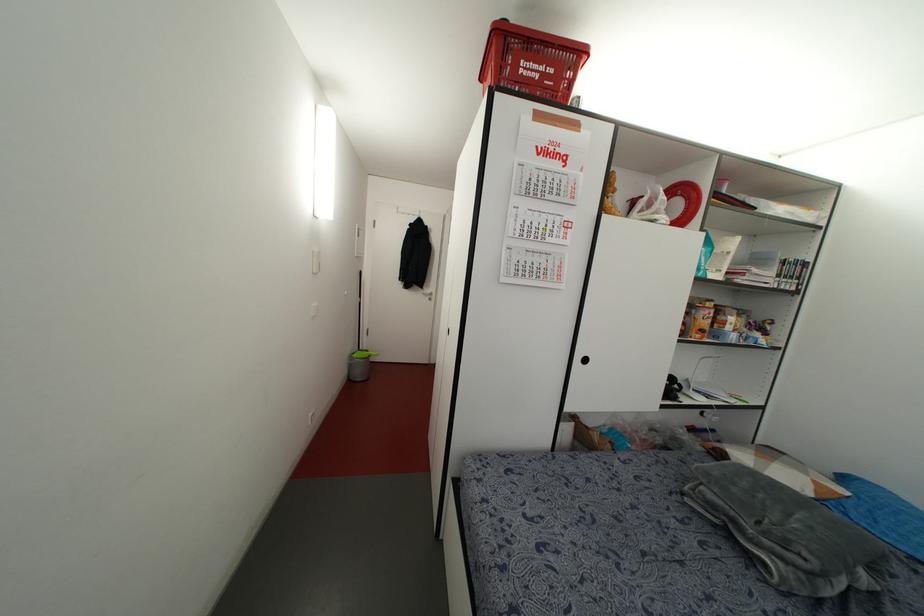
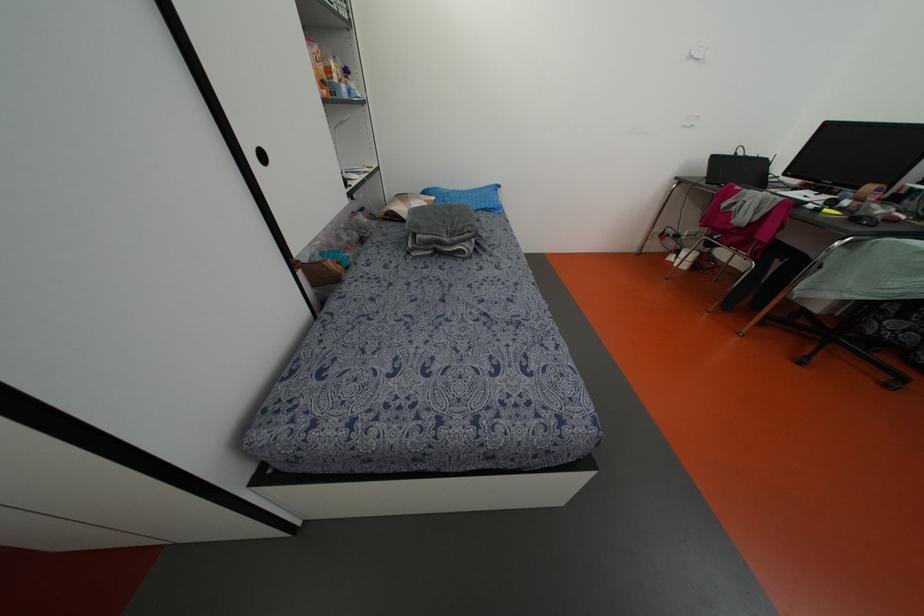
Locate, in the second image, the point that corresponds to [701,488] in the first image.

(418, 236)